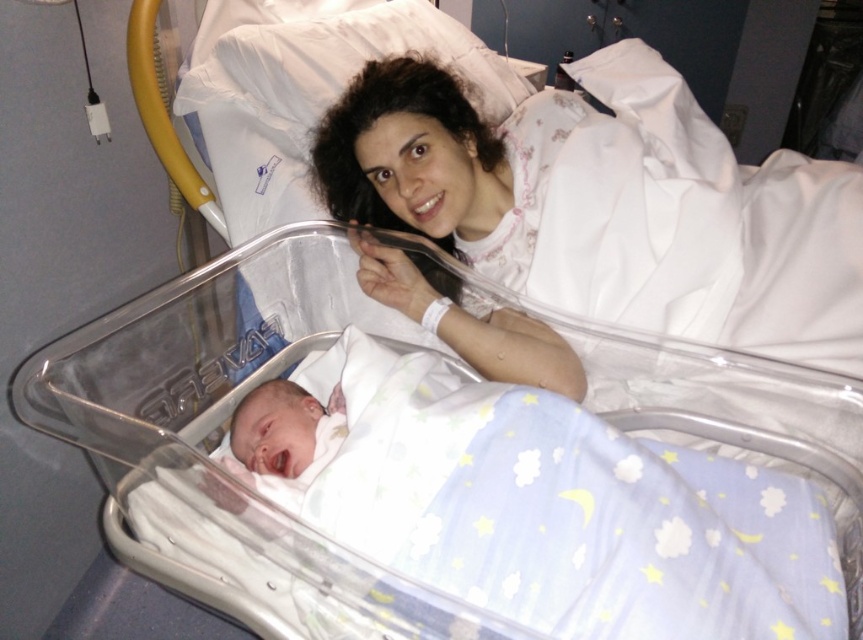
Question: Is white satin gown at upper center behind soft white swaddle at center?

Choices:
 (A) yes
 (B) no

Answer: (A)

Question: Does white satin gown at upper center have a larger size compared to soft white swaddle at center?

Choices:
 (A) no
 (B) yes

Answer: (B)

Question: Can you confirm if white satin gown at upper center is positioned to the right of soft white swaddle at center?

Choices:
 (A) yes
 (B) no

Answer: (A)

Question: Among these points, which one is nearest to the camera?

Choices:
 (A) (520, 323)
 (B) (262, 394)

Answer: (B)

Question: Which object is closer to the camera taking this photo?

Choices:
 (A) soft white swaddle at center
 (B) white satin gown at upper center

Answer: (A)